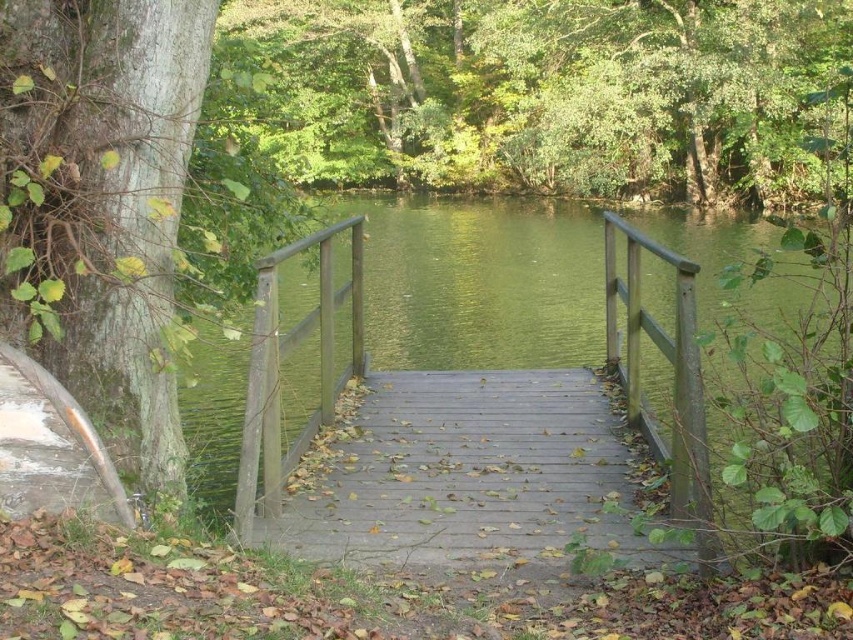
You are standing at the center of the wooden bridge and want to locate the green rough bark tree at left. Which direction should you look to see it?

The green rough bark tree at left is located at point (x=99, y=234), so you should look to the left side of the bridge to see it.

You are standing on the wooden bridge at center and looking towards the green leafy tree at upper center. Which object is closer to your viewpoint?

The green leafy tree at upper center is closer to your viewpoint because the wooden bridge at center is behind it.

You are standing on the wooden bridge and looking towards the water. There are two points marked on the bridge deck, one at point coordinates point (335,90) and the other at point coordinates point (544,547). Which point is closer to you?

Point (335,90) is further to the camera than point (544,547), so the point closer to you is point (544,547).